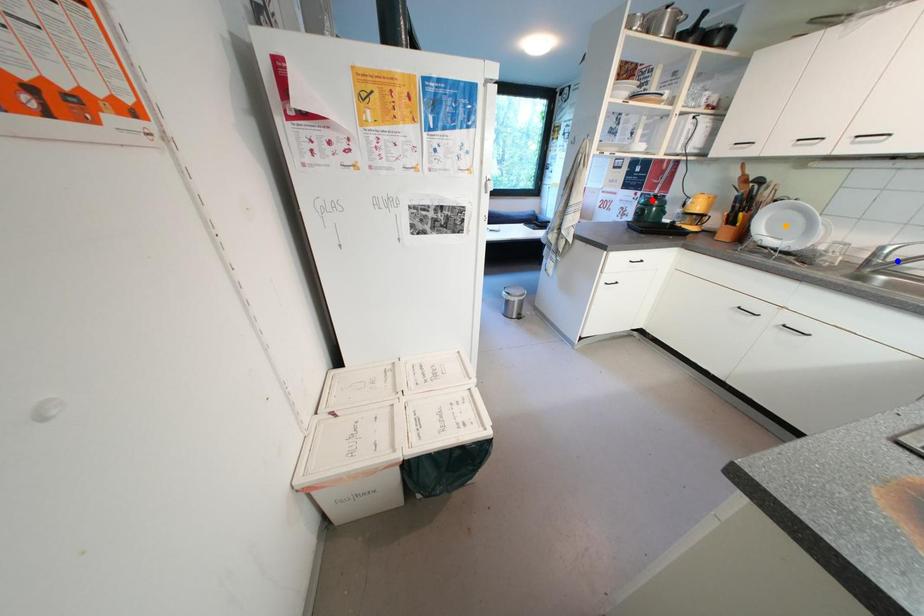
Order these from nearest to farthest:
1. red point
2. orange point
3. blue point

red point → orange point → blue point